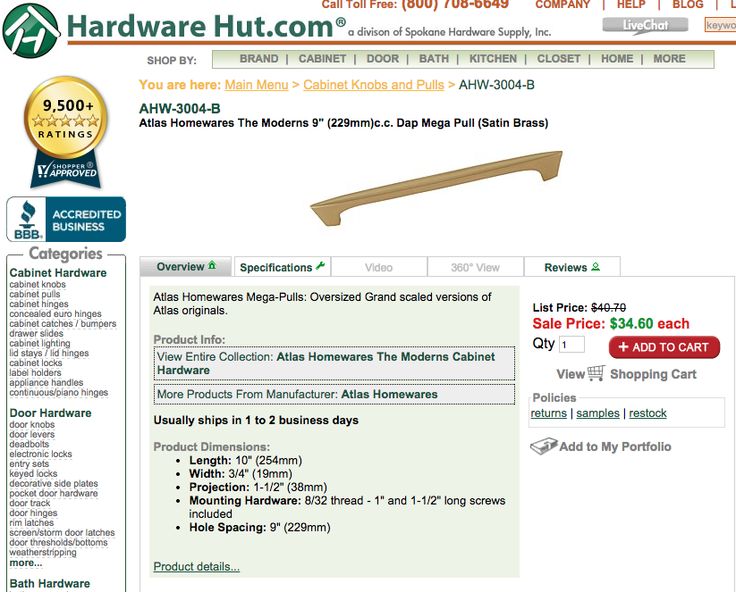
You are a GUI agent. You are given a task and a screenshot of the screen. Output one action in this format:
    pyautogui.click(x=<x>, y=<y>)
    Task: Click on the door hardware
    The image size is (736, 592).
    Given the screenshot: What is the action you would take?
    pyautogui.click(x=68, y=413)